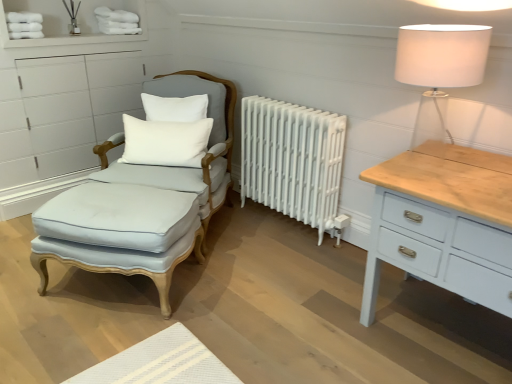
This screenshot has height=384, width=512. Find the location of `vacant area in front of white painted metal radiator at center`. vacant area in front of white painted metal radiator at center is located at coordinates tap(287, 262).